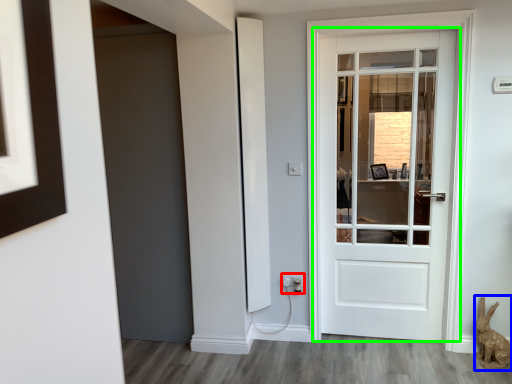
Question: Which object is the farthest from electric outlet (highlighted by a red box)? Choose among these: animal (highlighted by a blue box) or door (highlighted by a green box).

Choices:
 (A) animal
 (B) door

Answer: (B)